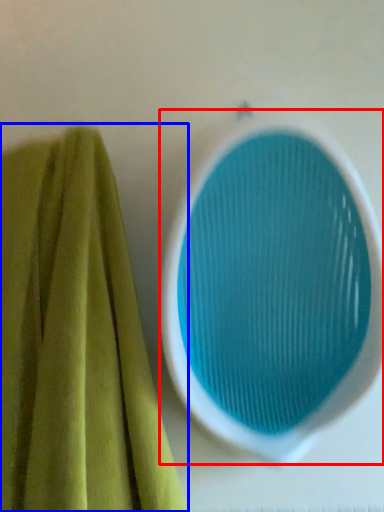
Question: Which of the following is the farthest to the observer, oval (highlighted by a red box) or towel (highlighted by a blue box)?

Choices:
 (A) oval
 (B) towel

Answer: (A)